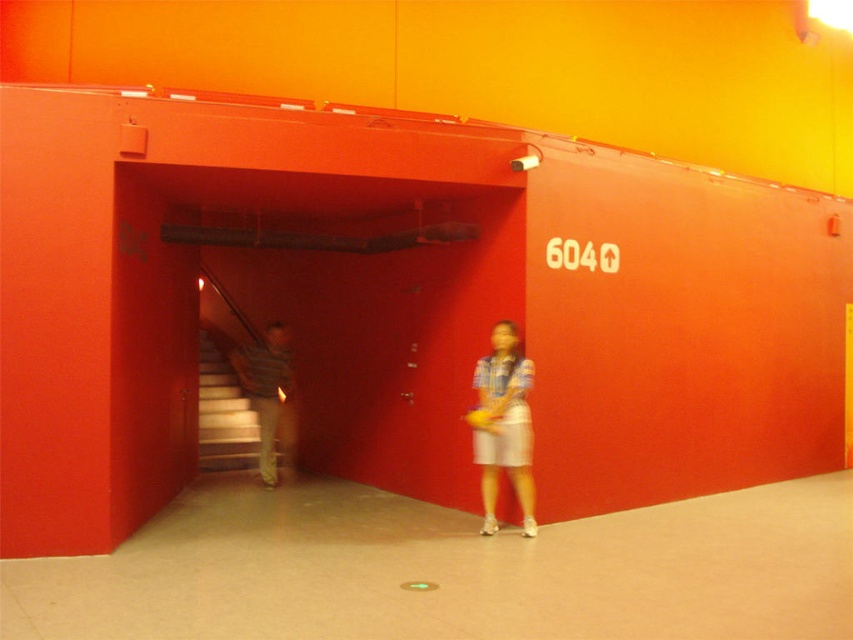
Question: Can you confirm if blue plaid shirt at center is positioned below wooden staircase at left?

Choices:
 (A) no
 (B) yes

Answer: (A)

Question: Does blue plaid shirt at center appear under wooden staircase at left?

Choices:
 (A) yes
 (B) no

Answer: (B)

Question: Which object appears closest to the camera in this image?

Choices:
 (A) blue plaid shirt at center
 (B) striped fabric shirt at left

Answer: (A)

Question: Can you confirm if blue plaid shirt at center is positioned above striped fabric shirt at left?

Choices:
 (A) yes
 (B) no

Answer: (B)

Question: Which object appears closest to the camera in this image?

Choices:
 (A) blue plaid shirt at center
 (B) wooden staircase at left

Answer: (A)

Question: Based on their relative distances, which object is farther from the striped fabric shirt at left?

Choices:
 (A) wooden staircase at left
 (B) blue plaid shirt at center

Answer: (B)